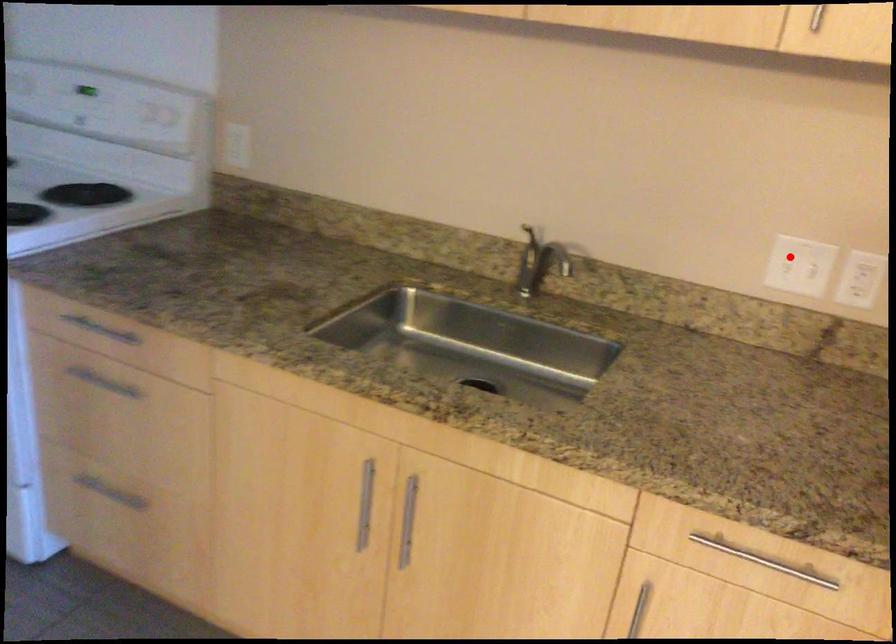
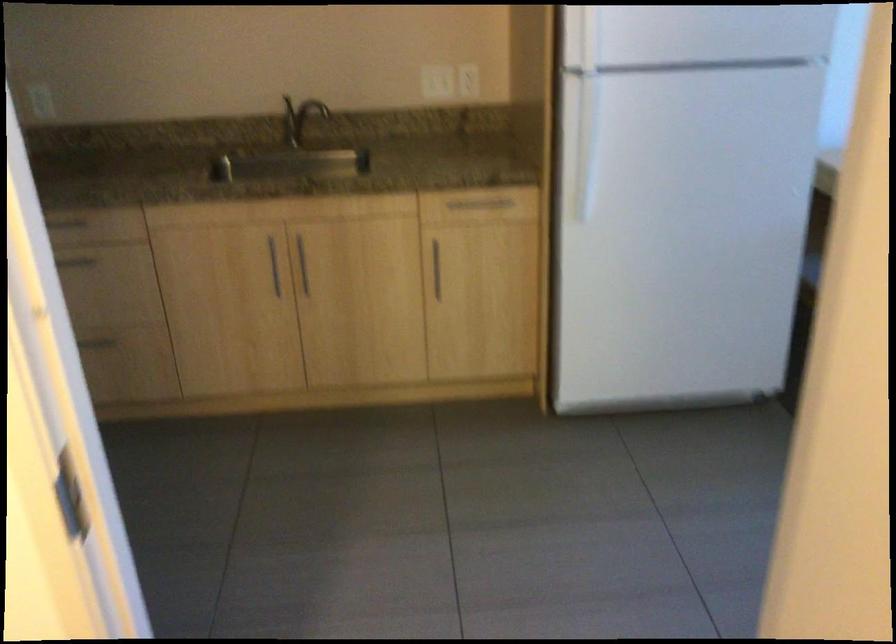
Question: I am providing you with two images of the same scene from different viewpoints. In image1, a red point is highlighted. Considering the same 3D point in image2, which of the following is correct?

Choices:
 (A) It is closer
 (B) It is farther

Answer: (B)